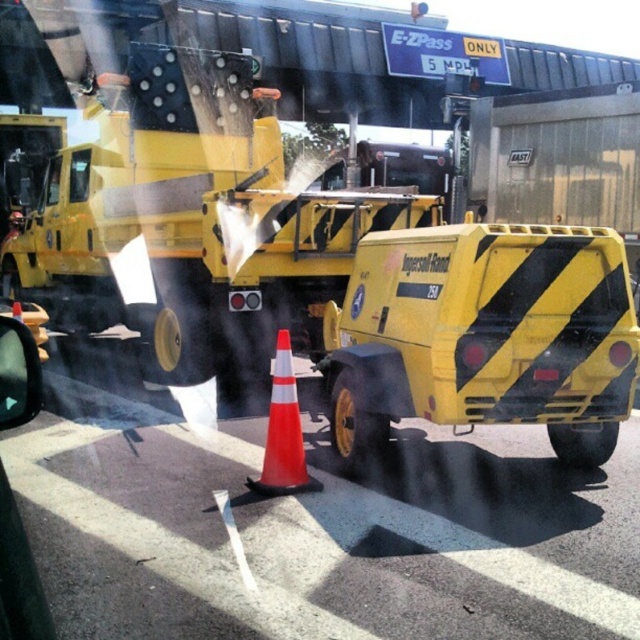
You are a construction worker standing at the camera position. You need to retrieve two points marked on the road for a survey. The first point is at point (x=582, y=316) and the second point is at point (x=300, y=445). Which point should you go to first to minimize walking distance?

You should go to point (x=582, y=316) first because it is closer to the camera than point (x=300, y=445).

You are a construction worker who needs to move the orange reflective cone at center to a new location. Can you safely step over the yellow matte asphalt roller at center to reach the cone?

The yellow matte asphalt roller at center is positioned over orange reflective cone at center, so you cannot safely step over the roller to reach the cone since the cone is already under the roller.

You are standing at the construction site and want to know how far the point at coordinates (492, 408) is from you. Can you determine the distance?

The point at coordinates (492, 408) is 5.01 meters away from the viewer.